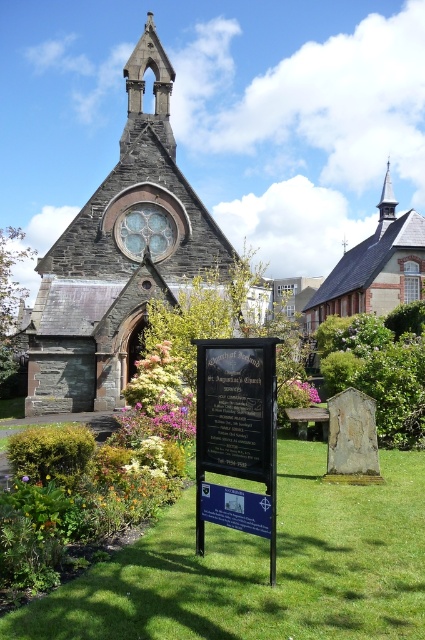
You are a visitor standing in front of St. Augustine Church. You see the black polished stone sign at center and the purple matte flower at center. Which object is positioned to the right side?

The black polished stone sign at center is to the right of the purple matte flower at center.